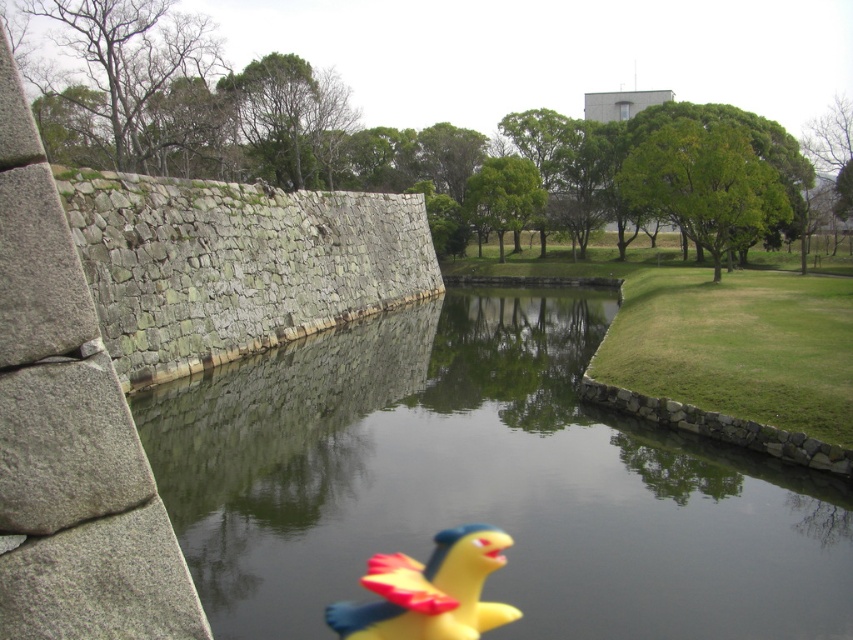
Question: Can you confirm if clear glass water at center is thinner than yellow rubber duck at center?

Choices:
 (A) no
 (B) yes

Answer: (A)

Question: Observing the image, what is the correct spatial positioning of clear glass water at center in reference to yellow rubber duck at center?

Choices:
 (A) below
 (B) above

Answer: (B)

Question: Does clear glass water at center lie in front of yellow rubber duck at center?

Choices:
 (A) yes
 (B) no

Answer: (B)

Question: Which point appears farthest from the camera in this image?

Choices:
 (A) (401, 628)
 (B) (526, 609)

Answer: (B)

Question: Which object is farther from the camera taking this photo?

Choices:
 (A) clear glass water at center
 (B) yellow rubber duck at center

Answer: (A)

Question: Which point is farther to the camera?

Choices:
 (A) (416, 634)
 (B) (223, 408)

Answer: (B)